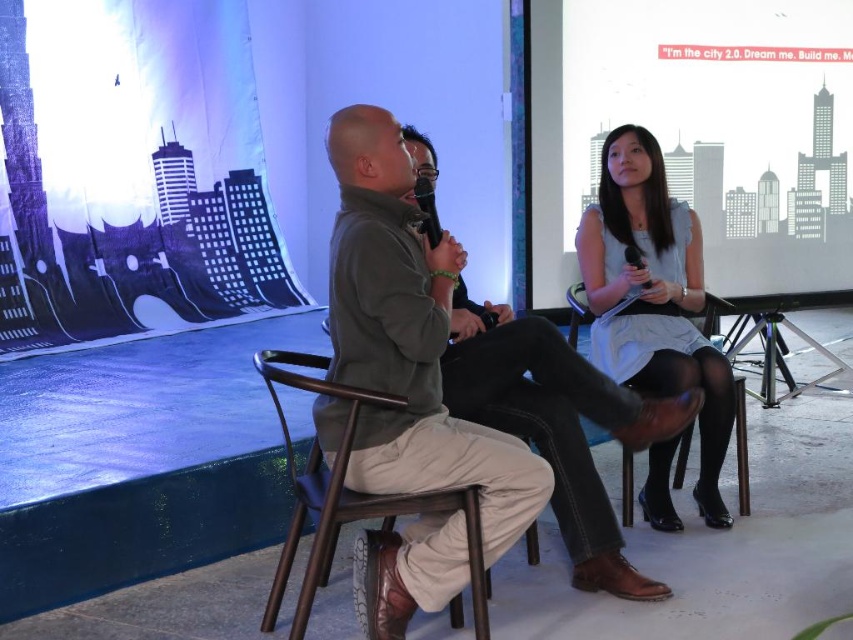
You are an event organizer checking the stage setup. You need to ensure that the white satin dress at right won not block the white matte projection screen at upper center during the presentation. Based on their sizes, is this possible?

The white matte projection screen at upper center is wider than the white satin dress at right, so the dress will not block the screen during the presentation.

You are an event organizer who needs to adjust seating arrangements. You see the matte gray shirt at center and the brown wood chair at center. Which one is positioned higher in the image?

The matte gray shirt at center is above brown wood chair at center, so the matte gray shirt at center is positioned higher in the image.

You are an event organizer trying to rearrange the stage for a more intimate setup. You need to place a small decorative plant between the khaki cotton pants at center and the brown wood chair at center. Considering their sizes, which object should the plant be closer to?

The khaki cotton pants at center is smaller than the brown wood chair at center, so the plant should be placed closer to the khaki cotton pants at center to maintain balance between the two objects.